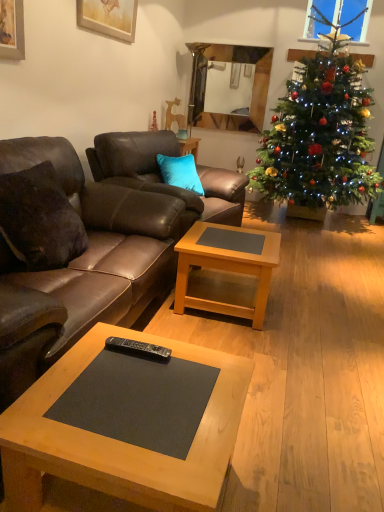
The width and height of the screenshot is (384, 512). Identify the location of vacant region above wooden matte coffee table at center, placed as the 1th coffee table when sorted from front to back (from a real-world perspective). (153, 397).